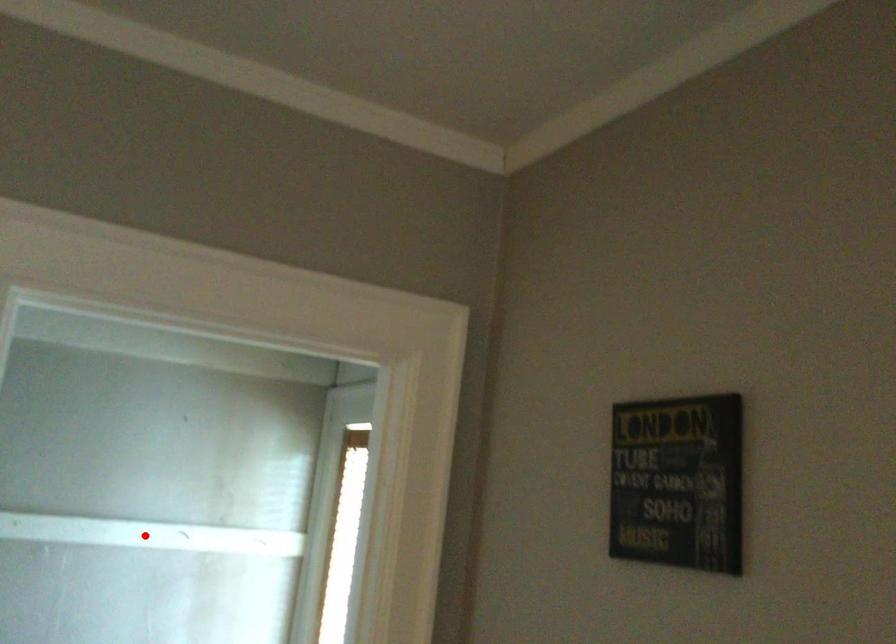
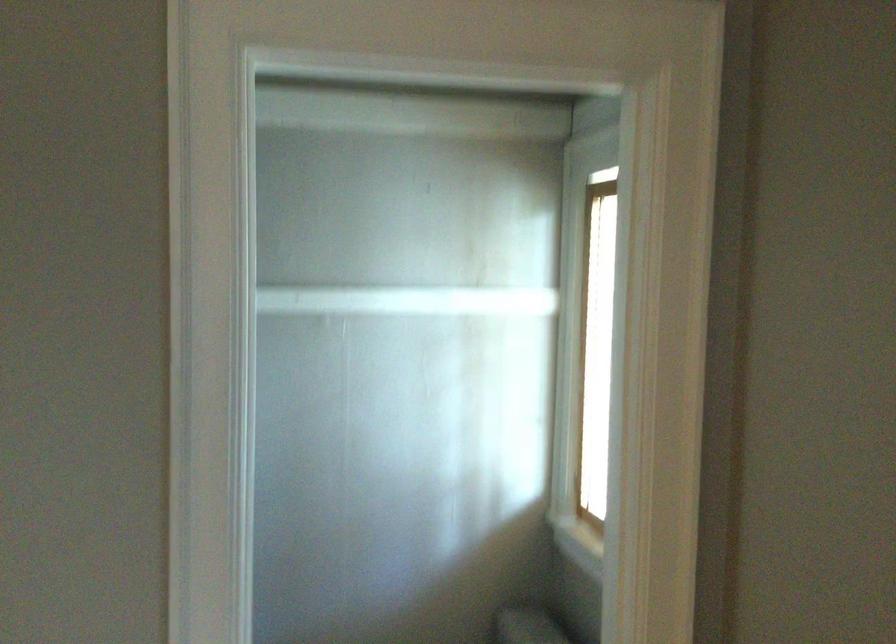
Question: I am providing you with two images of the same scene from different viewpoints. A red point is marked on the first image. At the location where the point appears in image 1, is it still visible in image 2?

Choices:
 (A) Yes
 (B) No

Answer: (A)